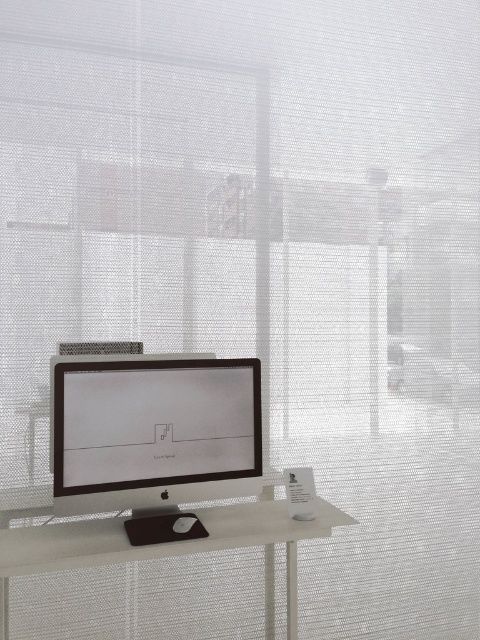
Question: Which point appears farthest from the camera in this image?

Choices:
 (A) pos(237,378)
 (B) pos(81,561)

Answer: (A)

Question: Considering the relative positions of matte black monitor at center and white matte computer desk at center in the image provided, where is matte black monitor at center located with respect to white matte computer desk at center?

Choices:
 (A) right
 (B) left

Answer: (B)

Question: Which point is farther to the camera?

Choices:
 (A) (215, 518)
 (B) (88, 465)

Answer: (A)

Question: From the image, what is the correct spatial relationship of matte black monitor at center in relation to white matte computer desk at center?

Choices:
 (A) left
 (B) right

Answer: (A)

Question: Does matte black monitor at center come behind white matte computer desk at center?

Choices:
 (A) yes
 (B) no

Answer: (A)